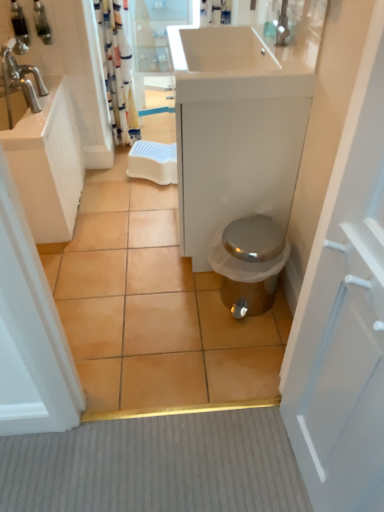
Question: Is transparent glass door at upper center outside translucent plastic soap dispenser at upper left, the first toiletry positioned from the right?

Choices:
 (A) yes
 (B) no

Answer: (A)

Question: Can you confirm if transparent glass door at upper center is positioned to the right of translucent plastic soap dispenser at upper left, which is counted as the second toiletry, starting from the left?

Choices:
 (A) no
 (B) yes

Answer: (B)

Question: Does transparent glass door at upper center have a lesser width compared to translucent plastic soap dispenser at upper left, the first toiletry positioned from the right?

Choices:
 (A) no
 (B) yes

Answer: (A)

Question: From the image's perspective, is transparent glass door at upper center on translucent plastic soap dispenser at upper left, the first toiletry positioned from the right?

Choices:
 (A) no
 (B) yes

Answer: (B)

Question: Is translucent plastic soap dispenser at upper left, which is counted as the second toiletry, starting from the left, at the back of transparent glass door at upper center?

Choices:
 (A) yes
 (B) no

Answer: (B)

Question: Is transparent glass door at upper center further to camera compared to translucent plastic soap dispenser at upper left, the first toiletry positioned from the right?

Choices:
 (A) yes
 (B) no

Answer: (A)

Question: Is brown ceramic tile at center positioned in front of brushed metal soap dispenser at upper left, acting as the 1th toiletry starting from the left?

Choices:
 (A) no
 (B) yes

Answer: (B)

Question: Does brown ceramic tile at center come behind brushed metal soap dispenser at upper left, the 2th toiletry when ordered from right to left?

Choices:
 (A) no
 (B) yes

Answer: (A)

Question: From the image's perspective, does brown ceramic tile at center appear lower than brushed metal soap dispenser at upper left, the 2th toiletry when ordered from right to left?

Choices:
 (A) yes
 (B) no

Answer: (A)

Question: From a real-world perspective, does brown ceramic tile at center stand above brushed metal soap dispenser at upper left, acting as the 1th toiletry starting from the left?

Choices:
 (A) yes
 (B) no

Answer: (B)

Question: Are brown ceramic tile at center and brushed metal soap dispenser at upper left, acting as the 1th toiletry starting from the left, far apart?

Choices:
 (A) yes
 (B) no

Answer: (A)

Question: Can you confirm if brown ceramic tile at center is smaller than brushed metal soap dispenser at upper left, acting as the 1th toiletry starting from the left?

Choices:
 (A) no
 (B) yes

Answer: (A)

Question: Does striped fabric shower curtain at upper left contain white glossy sink at upper left?

Choices:
 (A) yes
 (B) no

Answer: (B)